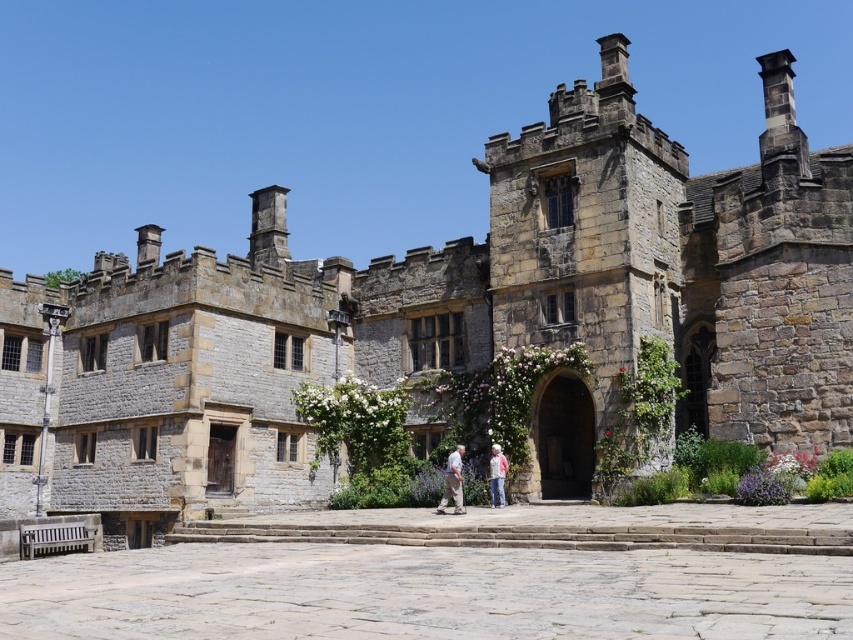
You are a photographer planning to take a group photo of the people standing near the entrance of the historic stone building. You need to position everyone so that the light pink fabric at center and the light beige fabric pants at center are not too close to each other. Given that the minimum comfortable distance for group photos is 24 inches, can these two items be positioned appropriately?

The light pink fabric at center and the light beige fabric pants at center are 24.31 inches apart, which exceeds the minimum comfortable distance of 24 inches. Therefore, they can be positioned appropriately for the group photo.

You are an artist standing in the courtyard of the historic building and want to sketch the two people dressed in light beige fabric pants at center and pink fabric jacket at center. Which clothing item is taller?

The light beige fabric pants at center has a greater height compared to the pink fabric jacket at center.